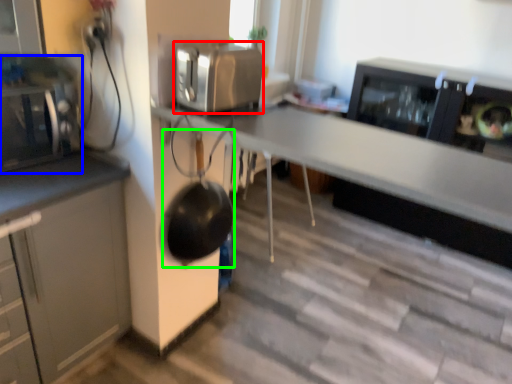
Question: Considering the real-world distances, which object is farthest from kitchen appliance (highlighted by a red box)? home appliance (highlighted by a blue box) or wok (highlighted by a green box)?

Choices:
 (A) home appliance
 (B) wok

Answer: (A)